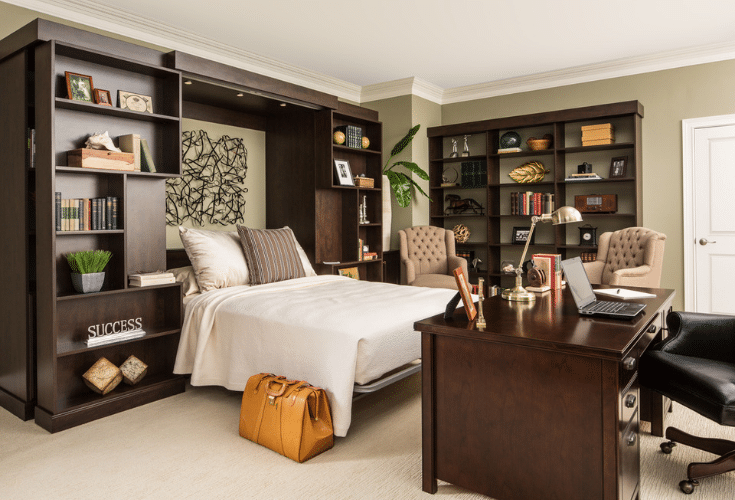
This screenshot has height=500, width=735. I want to click on beige singular soft chairs, so click(x=412, y=268), click(x=622, y=263).